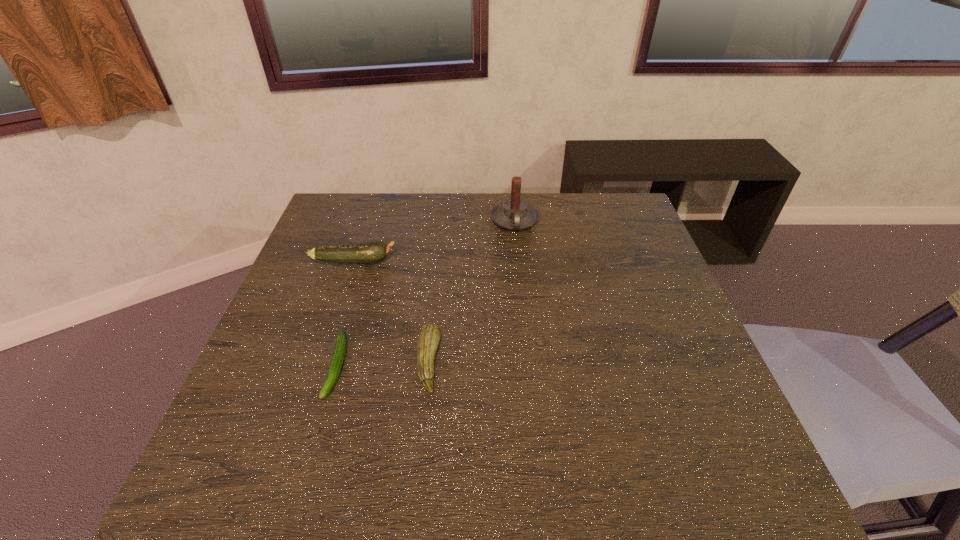
I want to click on free space between the shortest zucchini and the third shortest object, so click(x=346, y=313).

At what (x,y) coordinates should I click in order to perform the action: click on object that is the third closest one to the shortest zucchini. Please return your answer as a coordinate pair (x, y). Looking at the image, I should click on (514, 214).

At what (x,y) coordinates should I click in order to perform the action: click on object that is the closest one to the candle. Please return your answer as a coordinate pair (x, y). The height and width of the screenshot is (540, 960). Looking at the image, I should click on (375, 251).

The height and width of the screenshot is (540, 960). Find the location of `zucchini object that ranks as the closest to the shortest zucchini`. zucchini object that ranks as the closest to the shortest zucchini is located at coordinates (428, 339).

Select which zucchini is the second closest to the third tallest object. Please provide its 2D coordinates. Your answer should be formatted as a tuple, i.e. [(x, y)], where the tuple contains the x and y coordinates of a point satisfying the conditions above.

[(375, 251)]

The height and width of the screenshot is (540, 960). I want to click on vacant space that satisfies the following two spatial constraints: 1. on the side of the candle with the handle loop; 2. at the stem end of the second shortest object, so click(x=529, y=362).

The image size is (960, 540). I want to click on free space that satisfies the following two spatial constraints: 1. on the side of the candle with the handle loop; 2. at the stem end of the rightmost zucchini, so click(529, 362).

Identify the location of free space that satisfies the following two spatial constraints: 1. on the side of the farthest object with the handle loop; 2. at the stem end of the rightmost zucchini. This screenshot has width=960, height=540. (529, 362).

The width and height of the screenshot is (960, 540). I want to click on vacant space that satisfies the following two spatial constraints: 1. on the side of the farthest object with the handle loop; 2. at the stem end of the third tallest object, so click(529, 362).

Identify the location of vacant area in the image that satisfies the following two spatial constraints: 1. on the side of the tallest object with the handle loop; 2. at the stem end of the second tallest zucchini. (529, 362).